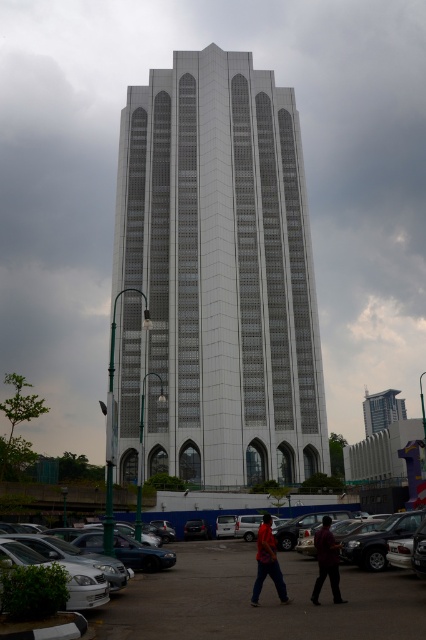
You are standing in the parking lot and see the white glass tower at center and the matte red shirt at center. Which object is located to the left of the other?

The white glass tower at center is positioned on the left side of matte red shirt at center.

What color is the shirt of the person located at point (267, 563) in the image?

The shirt at point (267, 563) is matte red.